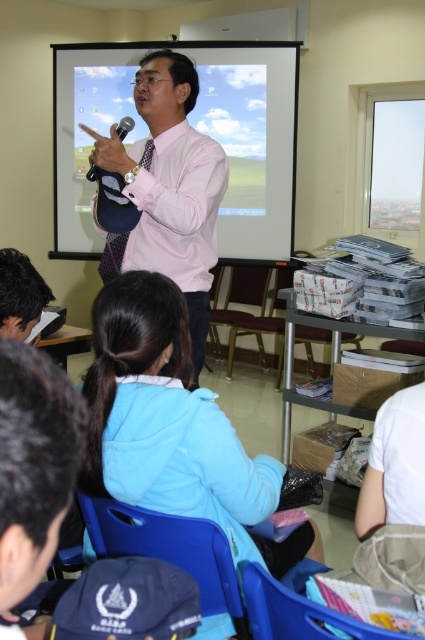
Question: Can you confirm if pink shirt at center is positioned below matte black microphone at upper center?

Choices:
 (A) yes
 (B) no

Answer: (A)

Question: Which of the following is the farthest from the observer?

Choices:
 (A) (135, 140)
 (B) (170, 125)
 (C) (88, 177)
 (D) (227, 438)

Answer: (A)

Question: Can you confirm if blue fleece jacket at lower center is thinner than pink shirt at center?

Choices:
 (A) yes
 (B) no

Answer: (B)

Question: Estimate the real-world distances between objects in this image. Which object is farther from the matte black microphone at upper center?

Choices:
 (A) white matte projection screen at upper center
 (B) blue fleece jacket at lower center
 (C) pink shirt at center

Answer: (A)

Question: Which point is farther from the camera taking this photo?

Choices:
 (A) (283, 218)
 (B) (95, 440)
 (C) (127, 125)

Answer: (A)

Question: Does white matte projection screen at upper center appear under pink shirt at center?

Choices:
 (A) yes
 (B) no

Answer: (B)